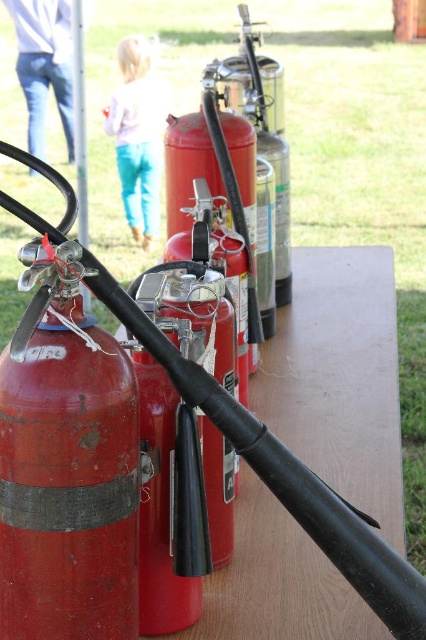
You are a visitor at a park and notice the matte red fire extinguisher at left and the light blue jeans at upper center. Which object is closer to you?

The matte red fire extinguisher at left is closer to you because it is in front of the light blue jeans at upper center.

You are standing at the point marked by the coordinates point (66, 468). Looking around, you see a matte red fire extinguisher at left. Which direction should you face to see the matte red fire extinguisher at left?

You should face to the left to see the matte red fire extinguisher at left since you are standing at the point marked by the coordinates point (66, 468).

You are standing at the origin point of the coordinate system. You need to locate the matte red fire extinguisher at left. What are its coordinates?

The coordinates of the matte red fire extinguisher at left are at point [66,468].